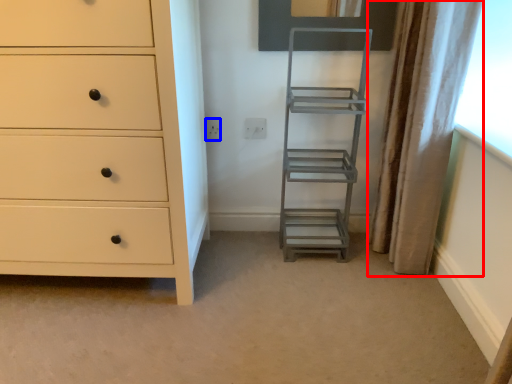
Question: Which object appears farthest to the camera in this image, curtain (highlighted by a red box) or electric outlet (highlighted by a blue box)?

Choices:
 (A) curtain
 (B) electric outlet

Answer: (B)